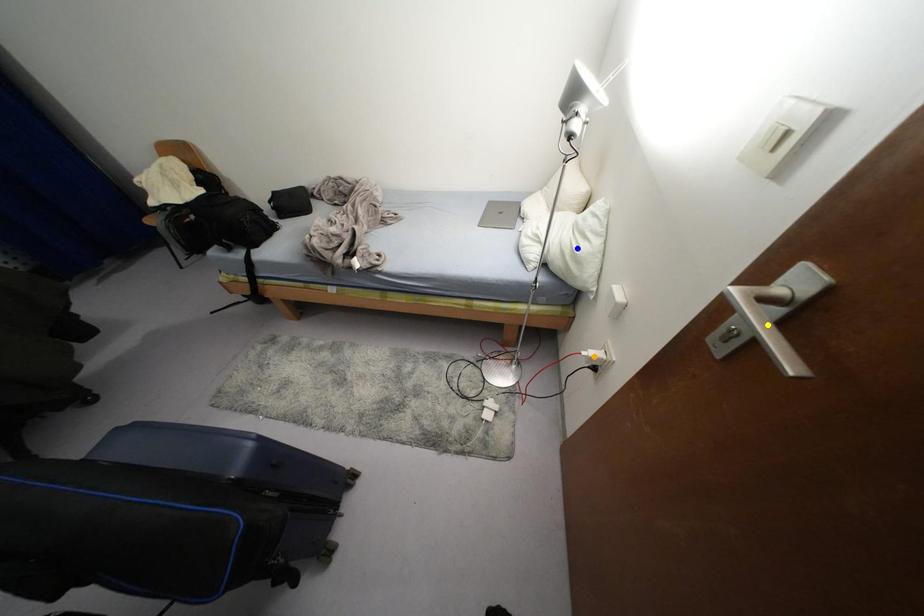
Order these from nearest to farthest:
blue point | orange point | yellow point

yellow point, blue point, orange point